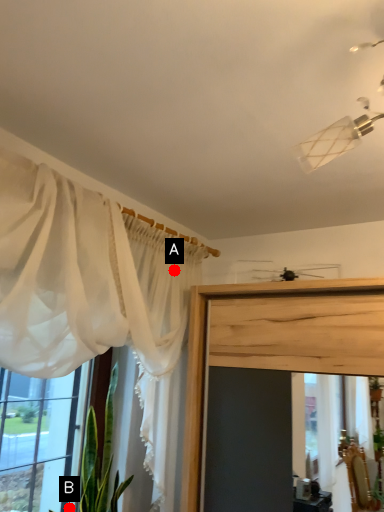
Question: Two points are circled on the image, labeled by A and B beside each circle. Among these points, which one is farthest from the camera?

Choices:
 (A) A is further
 (B) B is further

Answer: (A)